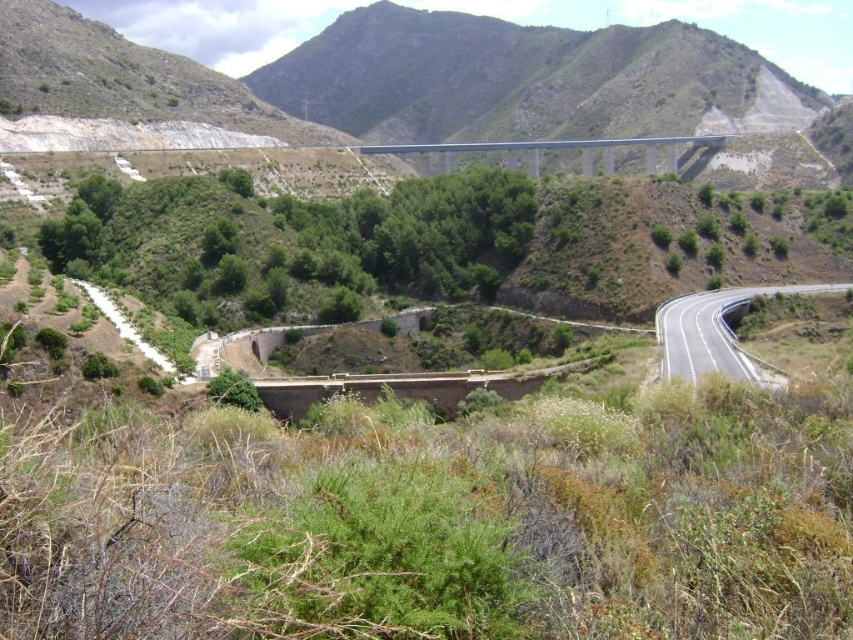
You are a drone operator planning to fly a drone from point A to point B along the winding road in the image. The coordinates for point A are point(749, 364) and point B are point(538, 141). According to the scene description, which point is closer to the camera, and therefore requires adjusting the drone altitude to avoid obstacles?

Point(749, 364) is closer to the camera than point(538, 141). Therefore, when flying the drone from point A to point B along the winding road, you should adjust the altitude starting from point A since it is closer to the camera and might have obstacles in that area.

You are a delivery truck driver planning to take the asphalt road at center and blue concrete bridge at center. The truck requires a minimum width of 4 meters to pass safely. Which route would you choose, and why?

The asphalt road at center is thinner than the blue concrete bridge at center. Since the truck requires a minimum of 4 meters, the blue concrete bridge at center is wider and safer for passage.